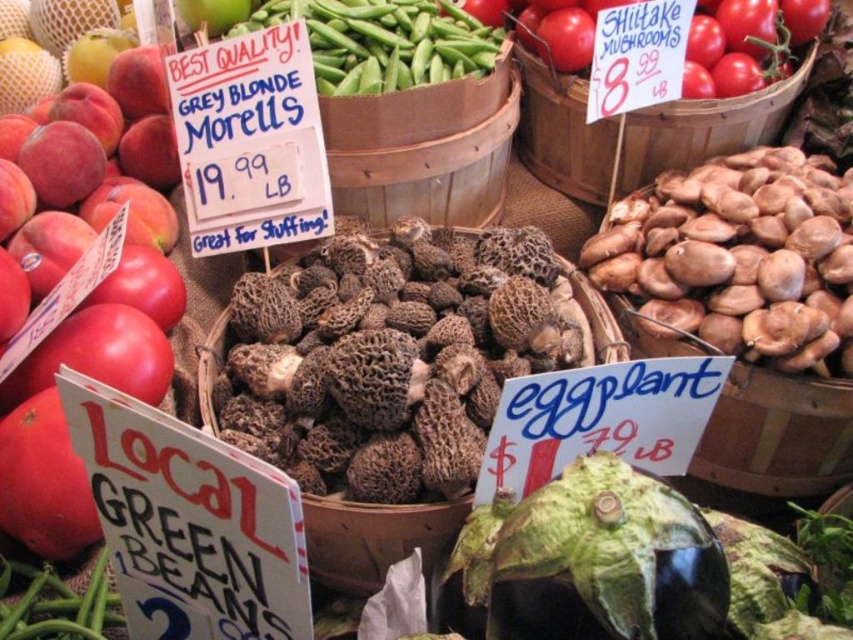
Question: Does black fuzzy mushrooms at center have a larger size compared to red matte tomatoes at upper right?

Choices:
 (A) yes
 (B) no

Answer: (A)

Question: Is black fuzzy mushrooms at center thinner than red matte tomatoes at upper right?

Choices:
 (A) no
 (B) yes

Answer: (B)

Question: Can you confirm if black fuzzy mushrooms at center is positioned below red matte tomatoes at upper right?

Choices:
 (A) yes
 (B) no

Answer: (A)

Question: Which object appears farthest from the camera in this image?

Choices:
 (A) black fuzzy mushrooms at center
 (B) red matte tomatoes at upper right

Answer: (B)